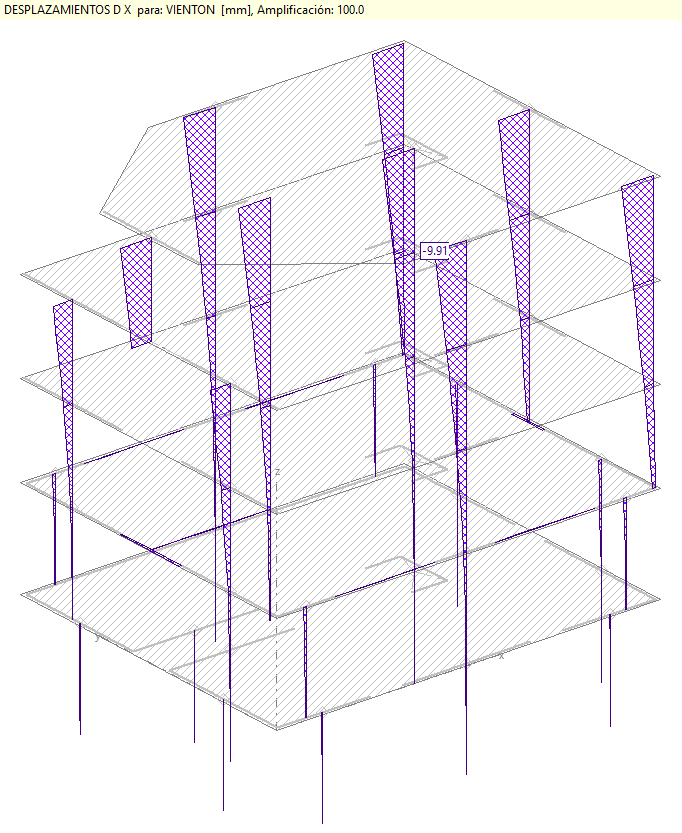
At what (x,y) coordinates should I click in order to perform the action: click on bracket. Please return your answer as a coordinate pair (x, y). Looking at the image, I should click on (430, 145).